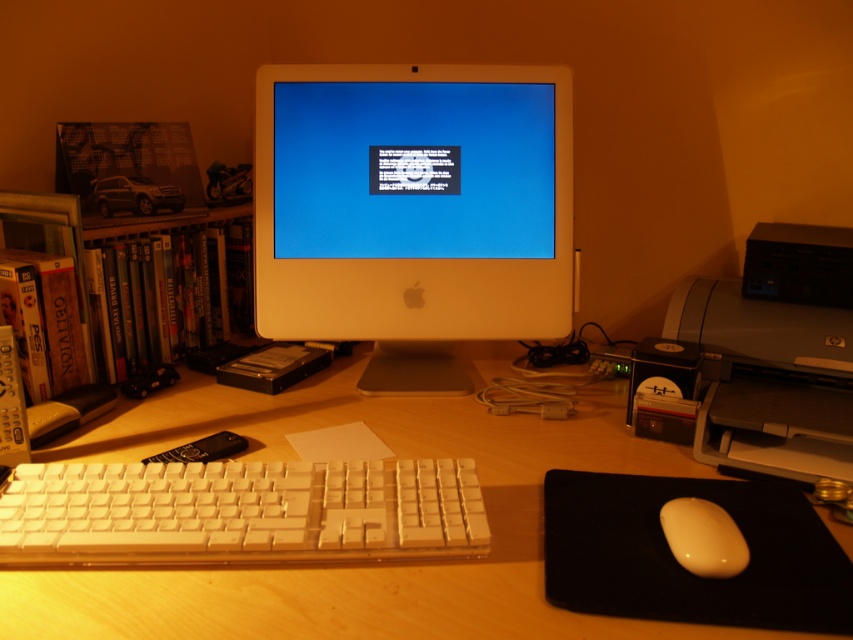
Who is taller, matte gray printer at right or matte yellow mouse at lower right?

matte gray printer at right is taller.

Who is lower down, matte gray printer at right or matte yellow mouse at lower right?

matte yellow mouse at lower right

Who is more forward, (704, 323) or (717, 518)?

Point (717, 518) is more forward.

Find the location of a particular element. matte gray printer at right is located at coordinates [x=775, y=355].

From the picture: Measure the distance between white plastic monitor at center and camera.

The distance of white plastic monitor at center from camera is 36.64 inches.

Who is shorter, white plastic monitor at center or shiny plastic dvds at left?

Standing shorter between the two is shiny plastic dvds at left.

Which is behind, point (254, 195) or point (160, 298)?

The point (160, 298) is behind.

Locate an element on the screen. This screenshot has width=853, height=640. white plastic monitor at center is located at coordinates (412, 211).

Who is more distant from viewer, (473, 108) or (788, 225)?

The point (788, 225) is behind.

Is white plastic monitor at center thinner than matte gray printer at right?

In fact, white plastic monitor at center might be wider than matte gray printer at right.

Find the location of `white plastic monitor at center`. white plastic monitor at center is located at coordinates (412, 211).